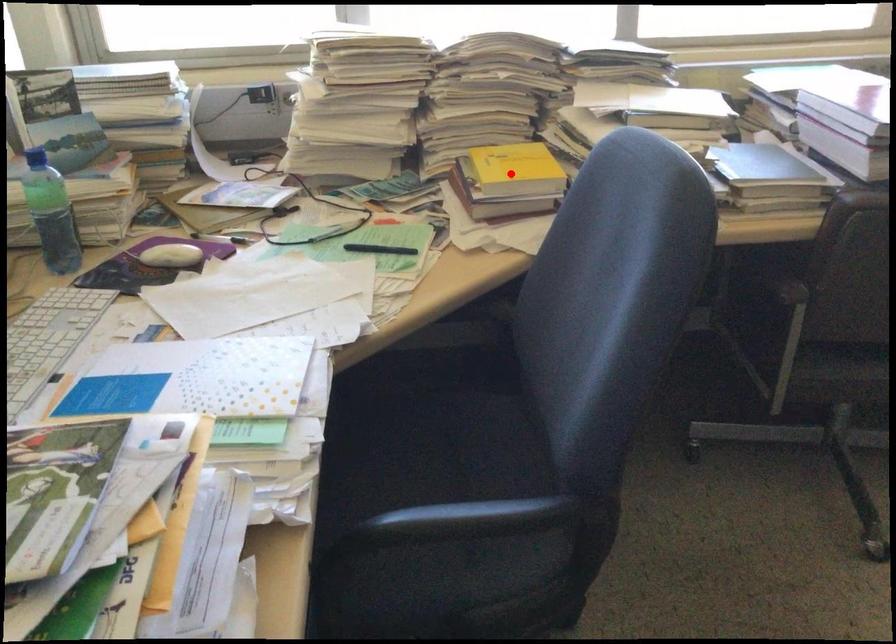
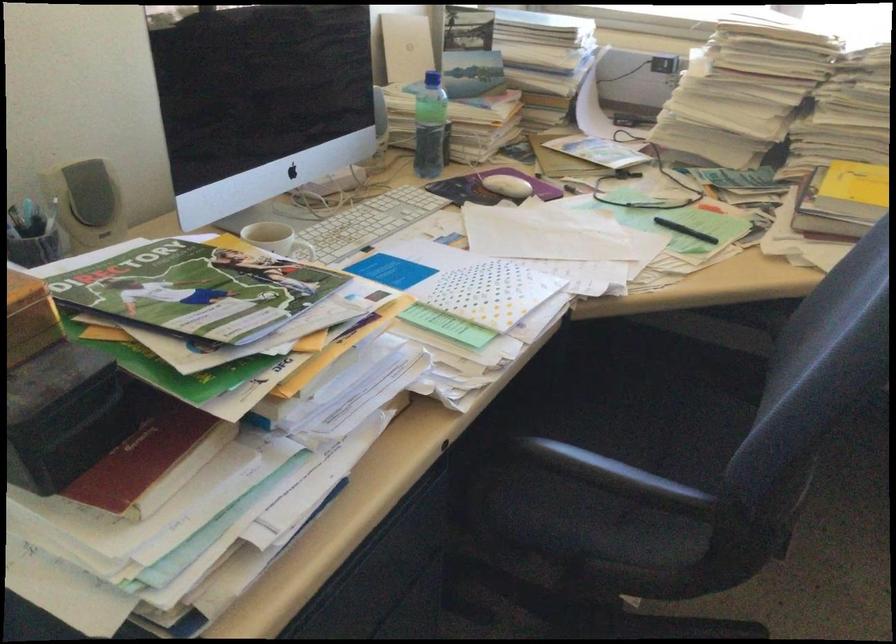
Find the pixel in the second image that matches the highlighted location in the first image.

(853, 194)